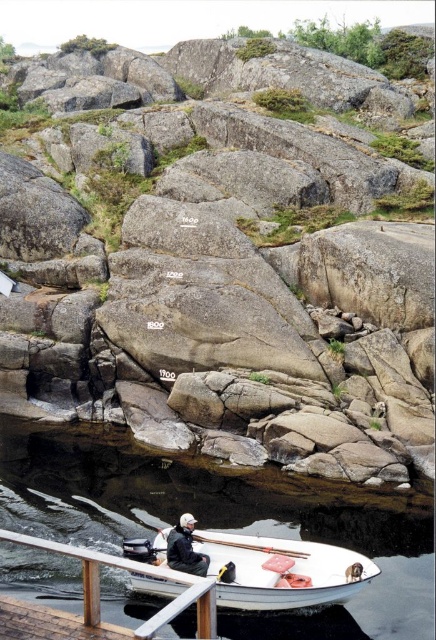
Question: Which point is closer to the camera?

Choices:
 (A) (125, 492)
 (B) (23, 618)
 (C) (200, 536)

Answer: (B)

Question: Estimate the real-world distances between objects in this image. Which object is farther from the dark gray fabric jacket at lower center?

Choices:
 (A) white wooden rail at lower center
 (B) gray rock at center
 (C) clear water at lower center

Answer: (B)

Question: Is clear water at lower center positioned before wooden smooth paddle at lower center?

Choices:
 (A) no
 (B) yes

Answer: (B)

Question: Is gray rock at center in front of dark gray fabric jacket at lower center?

Choices:
 (A) no
 (B) yes

Answer: (A)

Question: Which point appears farthest from the camera in this image?

Choices:
 (A) (296, 552)
 (B) (16, 381)
 (C) (322, 589)
 (D) (61, 433)

Answer: (B)

Question: Can you confirm if gray rock at center is positioned above white matte boat at lower center?

Choices:
 (A) yes
 (B) no

Answer: (A)